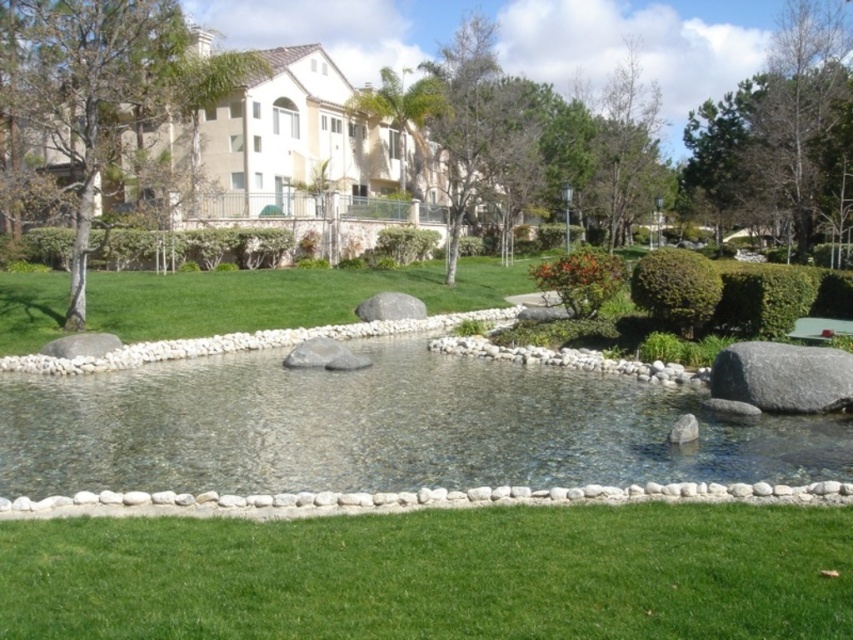
Question: Which of these objects is positioned farthest from the clear glass water at center?

Choices:
 (A) green leafy tree at upper right
 (B) brown textured tree at upper left
 (C) green grass at lower center

Answer: (A)

Question: Does green grass at lower center appear on the left side of brown textured tree at upper left?

Choices:
 (A) yes
 (B) no

Answer: (B)

Question: Is green grass at lower center bigger than clear glass water at center?

Choices:
 (A) yes
 (B) no

Answer: (B)

Question: Which of the following is the farthest from the observer?

Choices:
 (A) green grass at lower center
 (B) clear glass water at center

Answer: (B)

Question: Estimate the real-world distances between objects in this image. Which object is farther from the green leafy tree at upper right?

Choices:
 (A) brown textured tree at upper left
 (B) clear glass water at center

Answer: (B)

Question: Is clear glass water at center to the right of green leafy tree at upper right from the viewer's perspective?

Choices:
 (A) yes
 (B) no

Answer: (B)